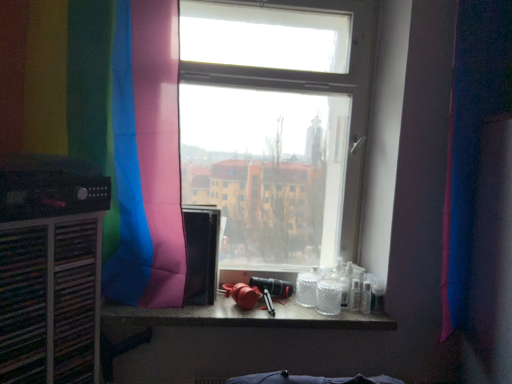
Question: In terms of size, does translucent glass counter top at center appear bigger or smaller than black matte speaker at left?

Choices:
 (A) small
 (B) big

Answer: (B)

Question: From their relative heights in the image, would you say translucent glass counter top at center is taller or shorter than black matte speaker at left?

Choices:
 (A) short
 (B) tall

Answer: (A)

Question: Which of these objects is positioned farthest from the translucent glass counter top at center?

Choices:
 (A) transparent glass window at center
 (B) black matte speaker at left
 (C) pink fabric curtain at right, the 1th curtain in the right-to-left sequence
 (D) rainbow fabric curtain at left, the first curtain when ordered from left to right

Answer: (C)

Question: Which is nearer to the transparent glass window at center?

Choices:
 (A) translucent glass counter top at center
 (B) pink fabric curtain at right, the second curtain from the left
 (C) black matte speaker at left
 (D) rainbow fabric curtain at left, the first curtain when ordered from left to right

Answer: (D)